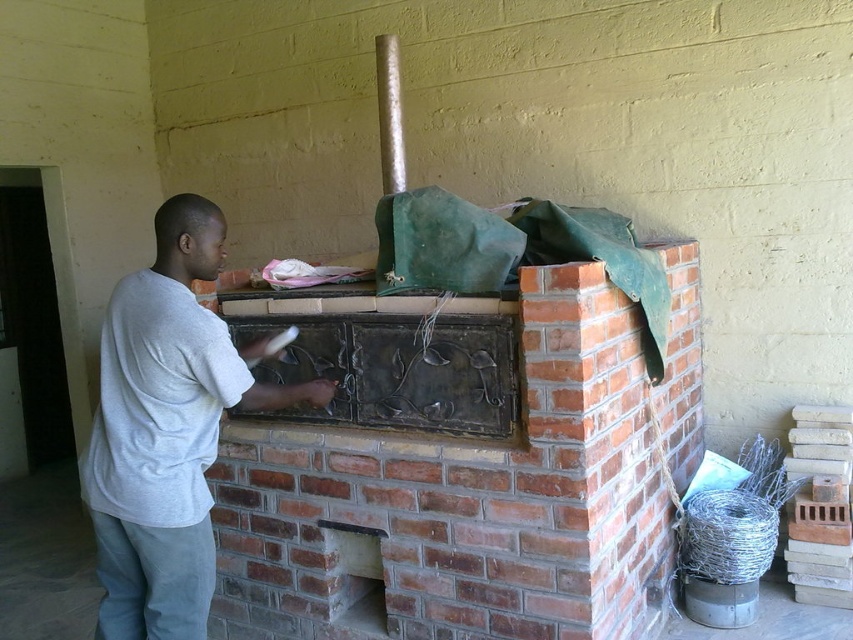
Does brick fireplace at center have a smaller size compared to gray cotton shirt at center?

Incorrect, brick fireplace at center is not smaller in size than gray cotton shirt at center.

Measure the distance between brick fireplace at center and camera.

A distance of 6.70 feet exists between brick fireplace at center and camera.

The width and height of the screenshot is (853, 640). Identify the location of brick fireplace at center. (463, 500).